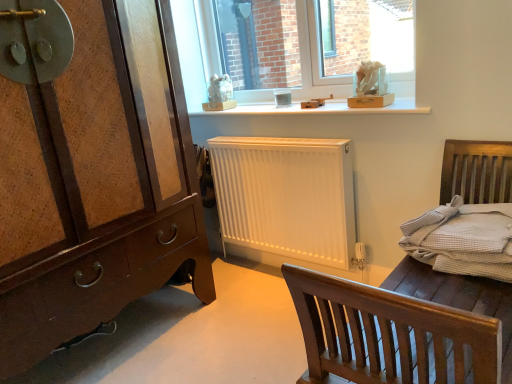
Question: Is the depth of white matte bed frame at center less than that of white wooden shelf at upper center?

Choices:
 (A) yes
 (B) no

Answer: (A)

Question: Is white matte bed frame at center at the right side of white wooden shelf at upper center?

Choices:
 (A) yes
 (B) no

Answer: (A)

Question: From a real-world perspective, is white matte bed frame at center located higher than white wooden shelf at upper center?

Choices:
 (A) no
 (B) yes

Answer: (A)

Question: Is white matte bed frame at center placed right next to white wooden shelf at upper center?

Choices:
 (A) yes
 (B) no

Answer: (B)

Question: Is white matte bed frame at center shorter than white wooden shelf at upper center?

Choices:
 (A) yes
 (B) no

Answer: (B)

Question: From the image's perspective, is transparent glass window at upper center located above or below light gray woven bedding at right?

Choices:
 (A) below
 (B) above

Answer: (B)

Question: Is transparent glass window at upper center wider or thinner than light gray woven bedding at right?

Choices:
 (A) wide
 (B) thin

Answer: (B)

Question: Looking at the image, does transparent glass window at upper center seem bigger or smaller compared to light gray woven bedding at right?

Choices:
 (A) big
 (B) small

Answer: (A)

Question: Based on their positions, is transparent glass window at upper center located to the left or right of light gray woven bedding at right?

Choices:
 (A) left
 (B) right

Answer: (A)

Question: Looking at the image, does white matte bed frame at center seem bigger or smaller compared to brown wood chest of drawers at left?

Choices:
 (A) big
 (B) small

Answer: (B)

Question: Relative to brown wood chest of drawers at left, is white matte bed frame at center in front or behind?

Choices:
 (A) behind
 (B) front

Answer: (B)

Question: Is white matte bed frame at center to the left or to the right of brown wood chest of drawers at left in the image?

Choices:
 (A) right
 (B) left

Answer: (A)

Question: In terms of height, does white matte bed frame at center look taller or shorter compared to brown wood chest of drawers at left?

Choices:
 (A) short
 (B) tall

Answer: (A)

Question: From a real-world perspective, is light gray woven bedding at right positioned above or below transparent glass window at upper center?

Choices:
 (A) below
 (B) above

Answer: (A)

Question: Does point (462, 258) appear closer or farther from the camera than point (210, 72)?

Choices:
 (A) farther
 (B) closer

Answer: (B)